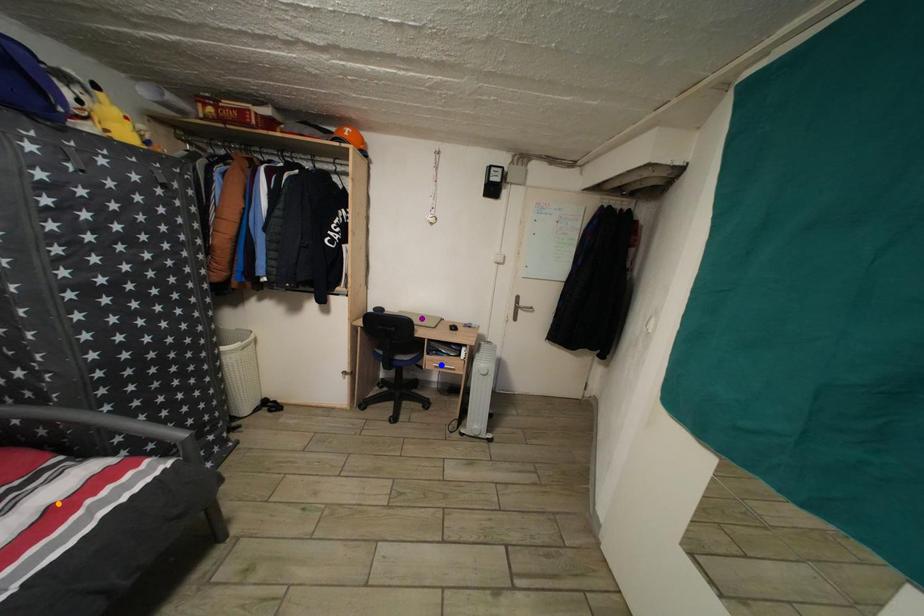
Order these from nearest to farthest:
blue point, purple point, orange point

purple point, blue point, orange point